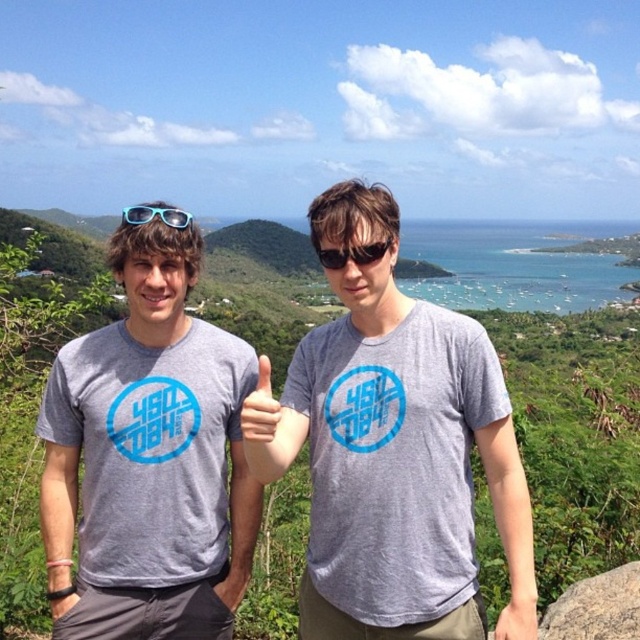
Question: Among these objects, which one is nearest to the camera?

Choices:
 (A) gray rough rock at lower right
 (B) matte gray t-shirt at center
 (C) gray cotton t-shirt at center
 (D) blue plastic sunglasses at upper left

Answer: (C)

Question: Can you confirm if gray cotton t-shirt at center is bigger than gray rough rock at lower right?

Choices:
 (A) yes
 (B) no

Answer: (A)

Question: Considering the real-world distances, which object is farthest from the gray cotton t-shirt at center?

Choices:
 (A) gray rough rock at lower right
 (B) blue plastic sunglasses at upper left

Answer: (B)

Question: Which of the following is the farthest from the observer?

Choices:
 (A) (358, 531)
 (B) (624, 602)

Answer: (B)

Question: Is gray cotton t-shirt at center to the left of gray rough rock at lower right from the viewer's perspective?

Choices:
 (A) no
 (B) yes

Answer: (B)

Question: Is matte gray t-shirt at center above blue plastic sunglasses at upper left?

Choices:
 (A) no
 (B) yes

Answer: (A)